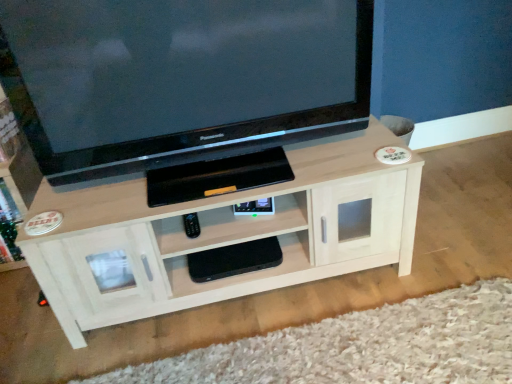
Question: Considering the relative positions of black matte gaming console at center, the second shelf viewed from the top, and black glossy television at upper center in the image provided, is black matte gaming console at center, the second shelf viewed from the top, to the left of black glossy television at upper center from the viewer's perspective?

Choices:
 (A) yes
 (B) no

Answer: (B)

Question: Does black matte gaming console at center, the second shelf viewed from the top, have a lesser width compared to black glossy television at upper center?

Choices:
 (A) yes
 (B) no

Answer: (A)

Question: From the image's perspective, would you say black matte gaming console at center, the second shelf viewed from the top, is positioned over black glossy television at upper center?

Choices:
 (A) yes
 (B) no

Answer: (B)

Question: From a real-world perspective, is black matte gaming console at center, the second shelf viewed from the top, positioned over black glossy television at upper center based on gravity?

Choices:
 (A) yes
 (B) no

Answer: (B)

Question: Can you confirm if black matte gaming console at center, the second shelf viewed from the top, is smaller than black glossy television at upper center?

Choices:
 (A) yes
 (B) no

Answer: (A)

Question: Is black matte gaming console at center, the 1th shelf positioned from the bottom, positioned far away from black glossy television at upper center?

Choices:
 (A) yes
 (B) no

Answer: (B)

Question: Is black glossy television at upper center a part of light wood shelf at center, which appears as the 1th shelf when viewed from the top?

Choices:
 (A) yes
 (B) no

Answer: (B)

Question: From the image's perspective, is light wood shelf at center, which appears as the 1th shelf when viewed from the top, located beneath black glossy television at upper center?

Choices:
 (A) no
 (B) yes

Answer: (B)

Question: Considering the relative sizes of light wood shelf at center, which appears as the 1th shelf when viewed from the top, and black glossy television at upper center in the image provided, is light wood shelf at center, which appears as the 1th shelf when viewed from the top, smaller than black glossy television at upper center?

Choices:
 (A) no
 (B) yes

Answer: (A)

Question: From a real-world perspective, is light wood shelf at center, marked as the second shelf in a bottom-to-top arrangement, beneath black glossy television at upper center?

Choices:
 (A) yes
 (B) no

Answer: (A)

Question: Would you consider light wood shelf at center, marked as the second shelf in a bottom-to-top arrangement, to be distant from black glossy television at upper center?

Choices:
 (A) yes
 (B) no

Answer: (B)

Question: Can you confirm if light wood shelf at center, marked as the second shelf in a bottom-to-top arrangement, is taller than black glossy television at upper center?

Choices:
 (A) no
 (B) yes

Answer: (A)

Question: Is white wood tv cabinet at lower left to the right of black matte gaming console at center, the 1th shelf positioned from the bottom, from the viewer's perspective?

Choices:
 (A) no
 (B) yes

Answer: (A)